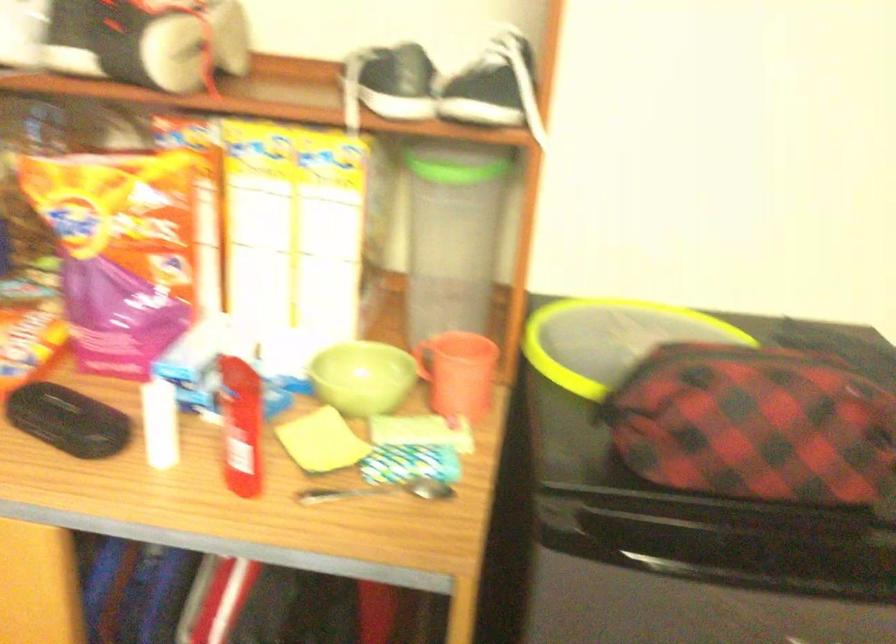
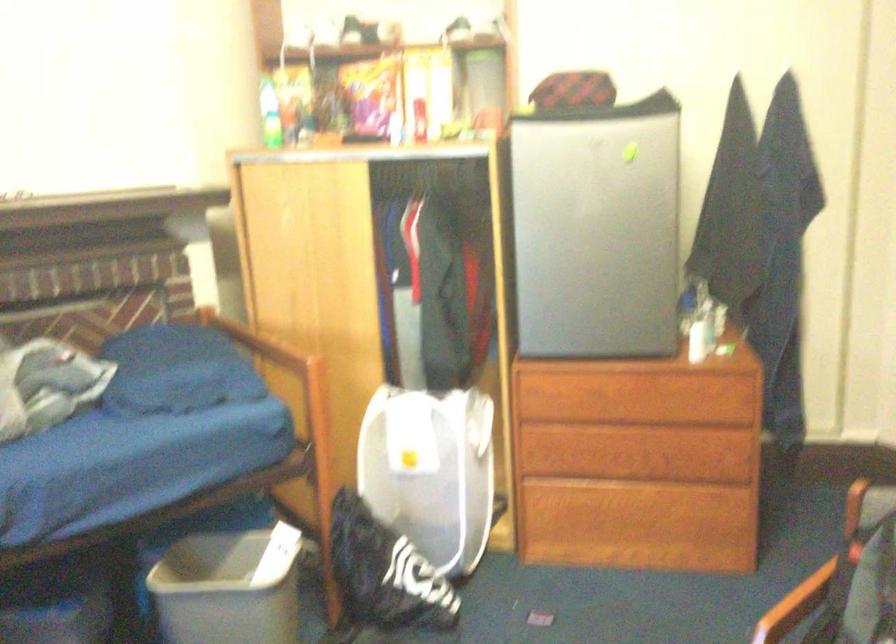
Question: What movement of the cameraman would produce the second image?

Choices:
 (A) Left
 (B) Right
 (C) Forward
 (D) Backward

Answer: (D)